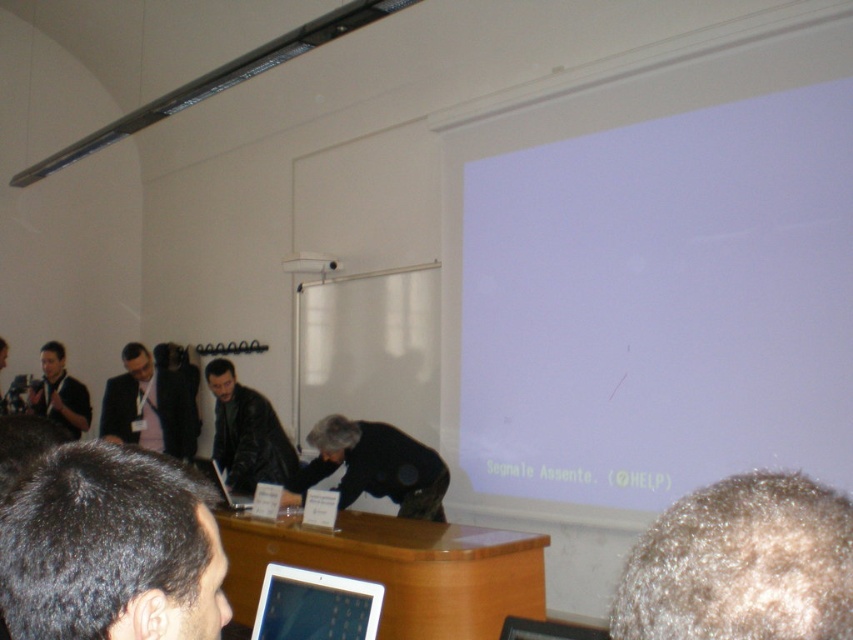
Question: Which point is closer to the camera taking this photo?

Choices:
 (A) (347, 611)
 (B) (459, 552)

Answer: (A)

Question: Does white matte projection screen at upper right appear on the right side of dark brown hair at lower left?

Choices:
 (A) yes
 (B) no

Answer: (A)

Question: Is wooden table at center smaller than leather jacket at center?

Choices:
 (A) yes
 (B) no

Answer: (B)

Question: Which of the following is the farthest from the observer?

Choices:
 (A) dark suit at left
 (B) dark brown hair at lower left
 (C) gray hair at upper right

Answer: (A)

Question: Does white matte projection screen at upper right have a larger size compared to wooden table at center?

Choices:
 (A) no
 (B) yes

Answer: (B)

Question: Estimate the real-world distances between objects in this image. Which object is closer to the wooden table at center?

Choices:
 (A) dark suit at left
 (B) gray hair at upper right
 (C) leather jacket at center

Answer: (C)